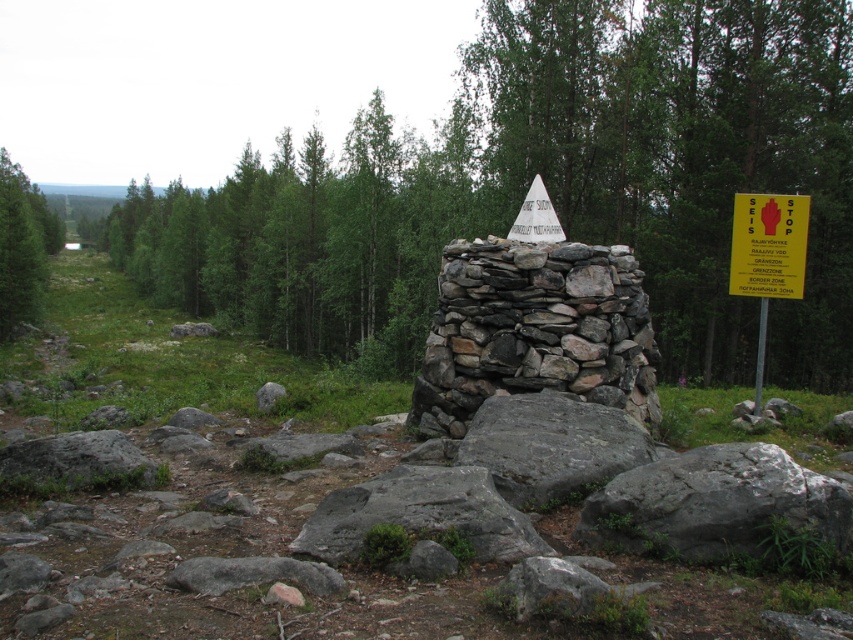
Question: Among these objects, which one is nearest to the camera?

Choices:
 (A) yellow paper triangle at center
 (B) green leafy tree at center

Answer: (A)

Question: Can you confirm if green leafy tree at center is wider than yellow paper sign at right?

Choices:
 (A) no
 (B) yes

Answer: (B)

Question: Can you confirm if green leafy tree at left is positioned above yellow paper sign at right?

Choices:
 (A) yes
 (B) no

Answer: (A)

Question: Among these points, which one is farthest from the camera?

Choices:
 (A) click(805, 221)
 (B) click(467, 264)

Answer: (A)

Question: Which of the following is the closest to the observer?

Choices:
 (A) yellow paper triangle at center
 (B) yellow paper sign at right

Answer: (A)

Question: Considering the relative positions of natural stone cairn at center and green leafy tree at left in the image provided, where is natural stone cairn at center located with respect to green leafy tree at left?

Choices:
 (A) above
 (B) below

Answer: (B)